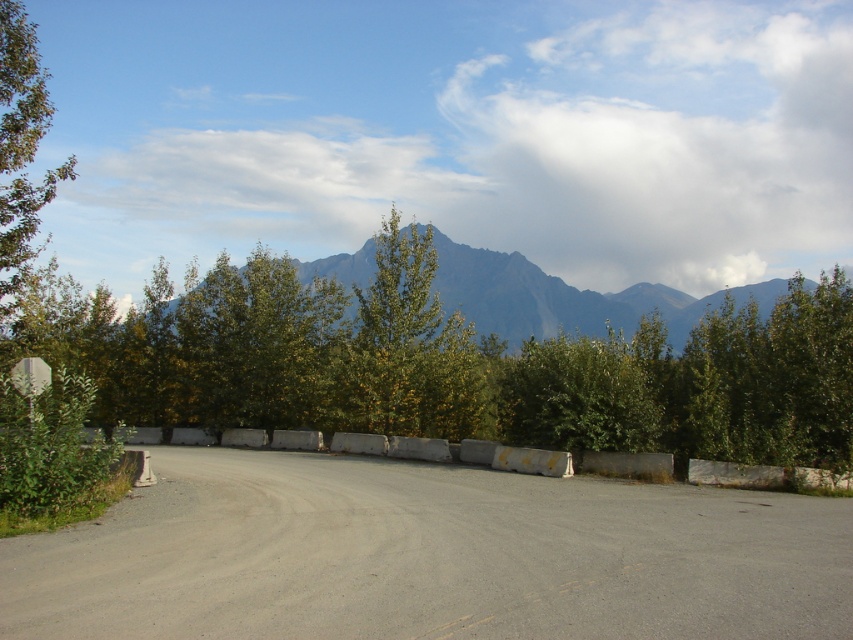
Can you confirm if green leafy tree at center is positioned above concrete barrier at center?

Correct, green leafy tree at center is located above concrete barrier at center.

Is the position of green leafy tree at center less distant than that of concrete barrier at center?

No, it is not.

Is point (656, 426) positioned after point (171, 440)?

No, (656, 426) is closer to viewer.

The width and height of the screenshot is (853, 640). What are the coordinates of `green leafy tree at center` in the screenshot? It's located at (448, 364).

Does green leafy tree at center have a lesser width compared to green leafy tree at left?

No, green leafy tree at center is not thinner than green leafy tree at left.

Who is shorter, green leafy tree at center or green leafy tree at left?

green leafy tree at center is shorter.

Who is more distant from viewer, (345, 419) or (16, 227)?

The point (345, 419) is more distant.

In order to click on green leafy tree at center in this screenshot , I will do `click(448, 364)`.

Which of these two, gray asphalt dirt track at center or green textured mountain at center, stands shorter?

gray asphalt dirt track at center is shorter.

Does gray asphalt dirt track at center have a greater width compared to green textured mountain at center?

In fact, gray asphalt dirt track at center might be narrower than green textured mountain at center.

The width and height of the screenshot is (853, 640). I want to click on gray asphalt dirt track at center, so click(x=428, y=556).